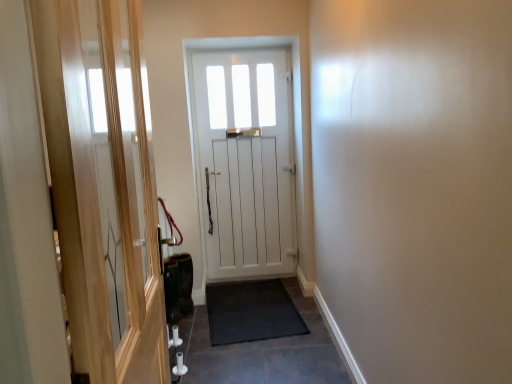
Question: Is white wooden door at center behind black rubber doormat at center?

Choices:
 (A) yes
 (B) no

Answer: (A)

Question: From the image's perspective, does white wooden door at center appear lower than black rubber doormat at center?

Choices:
 (A) yes
 (B) no

Answer: (B)

Question: Does white wooden door at center appear on the left side of black rubber doormat at center?

Choices:
 (A) no
 (B) yes

Answer: (B)

Question: Is white wooden door at center taller than black rubber doormat at center?

Choices:
 (A) yes
 (B) no

Answer: (A)

Question: Considering the relative sizes of white wooden door at center and black rubber doormat at center in the image provided, is white wooden door at center shorter than black rubber doormat at center?

Choices:
 (A) no
 (B) yes

Answer: (A)

Question: From the image's perspective, is white wooden door at center above or below black rubber mat at center?

Choices:
 (A) below
 (B) above

Answer: (B)

Question: Is white wooden door at center wider or thinner than black rubber mat at center?

Choices:
 (A) wide
 (B) thin

Answer: (B)

Question: Is point (231, 127) closer or farther from the camera than point (184, 380)?

Choices:
 (A) farther
 (B) closer

Answer: (A)

Question: In terms of height, does white wooden door at center look taller or shorter compared to black rubber mat at center?

Choices:
 (A) tall
 (B) short

Answer: (A)

Question: Considering the positions of black rubber doormat at center and transparent glass screen door at left in the image, is black rubber doormat at center wider or thinner than transparent glass screen door at left?

Choices:
 (A) thin
 (B) wide

Answer: (B)

Question: Considering their positions, is black rubber doormat at center located in front of or behind transparent glass screen door at left?

Choices:
 (A) behind
 (B) front

Answer: (A)

Question: In terms of size, does black rubber doormat at center appear bigger or smaller than transparent glass screen door at left?

Choices:
 (A) big
 (B) small

Answer: (B)

Question: From the image's perspective, is black rubber doormat at center positioned above or below transparent glass screen door at left?

Choices:
 (A) above
 (B) below

Answer: (B)

Question: From a real-world perspective, is transparent glass screen door at left above or below white wooden door at center?

Choices:
 (A) below
 (B) above

Answer: (B)

Question: Considering their positions, is transparent glass screen door at left located in front of or behind white wooden door at center?

Choices:
 (A) behind
 (B) front

Answer: (B)